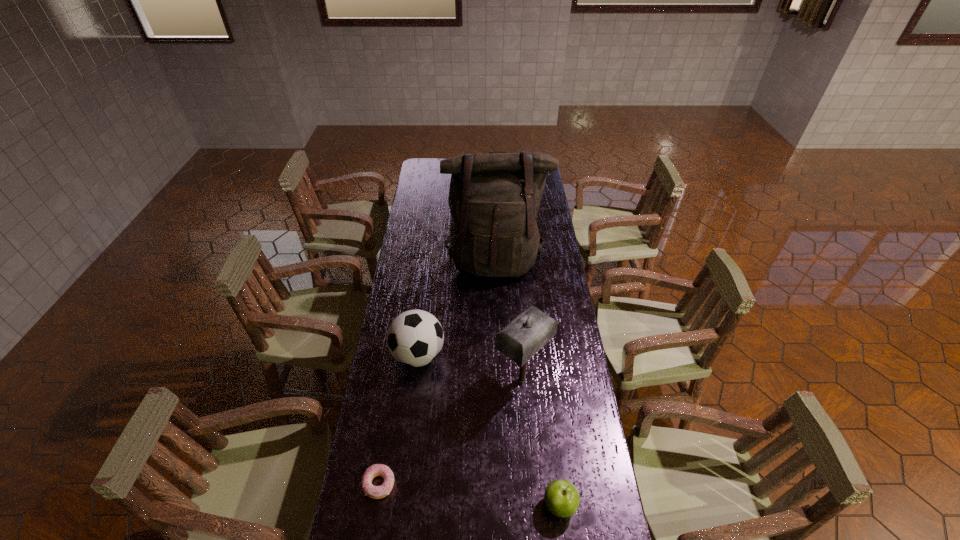
Locate an element on the screen. vacant area between the tallest object and the doughnut is located at coordinates (437, 373).

The image size is (960, 540). I want to click on vacant space that's between the apple and the tallest object, so click(x=527, y=383).

Image resolution: width=960 pixels, height=540 pixels. In order to click on empty space between the second shortest object and the mallet in this screenshot , I will do 540,442.

The image size is (960, 540). I want to click on free space between the fourth tallest object and the mallet, so click(540, 442).

Locate an element on the screen. This screenshot has width=960, height=540. blank region between the doughnut and the backpack is located at coordinates (437, 373).

Locate an element on the screen. The width and height of the screenshot is (960, 540). vacant point located between the apple and the doughnut is located at coordinates (469, 494).

This screenshot has height=540, width=960. I want to click on unoccupied position between the fourth tallest object and the second tallest object, so pos(540,442).

This screenshot has height=540, width=960. I want to click on blank region between the mallet and the backpack, so click(x=508, y=321).

The height and width of the screenshot is (540, 960). I want to click on object that ranks as the second closest to the farthest object, so click(524, 336).

The height and width of the screenshot is (540, 960). Identify the location of object that can be found as the third closest to the soccer ball. (376, 492).